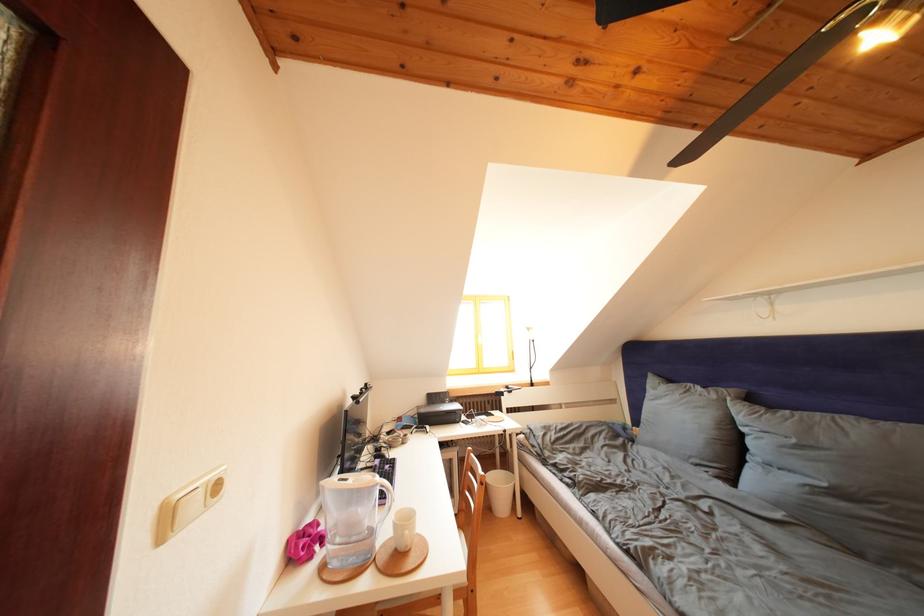
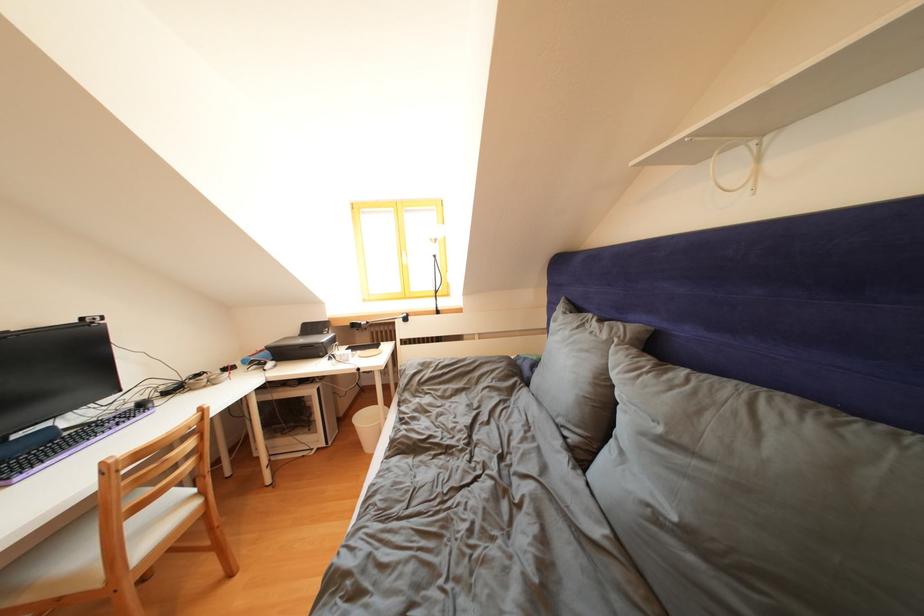
Locate, in the second image, the point that corresponds to point 441,403 in the first image.

(319, 333)